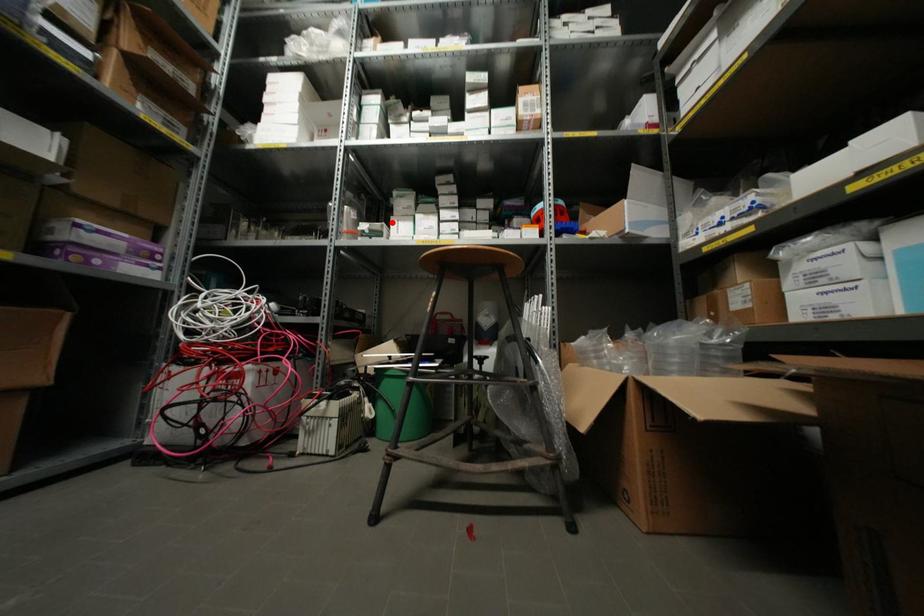
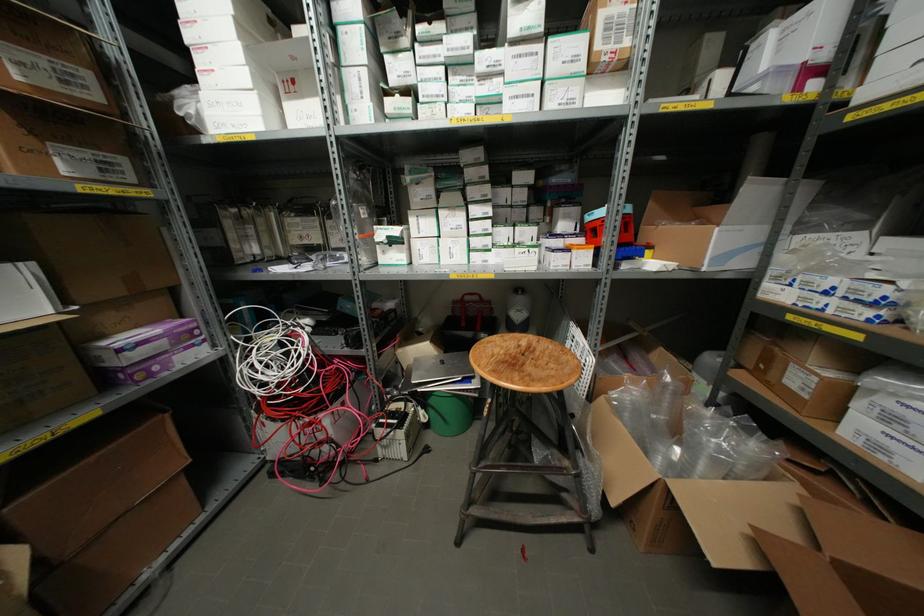
Locate, in the second image, the point that corresponds to the highlighted location in the first image.

(410, 219)